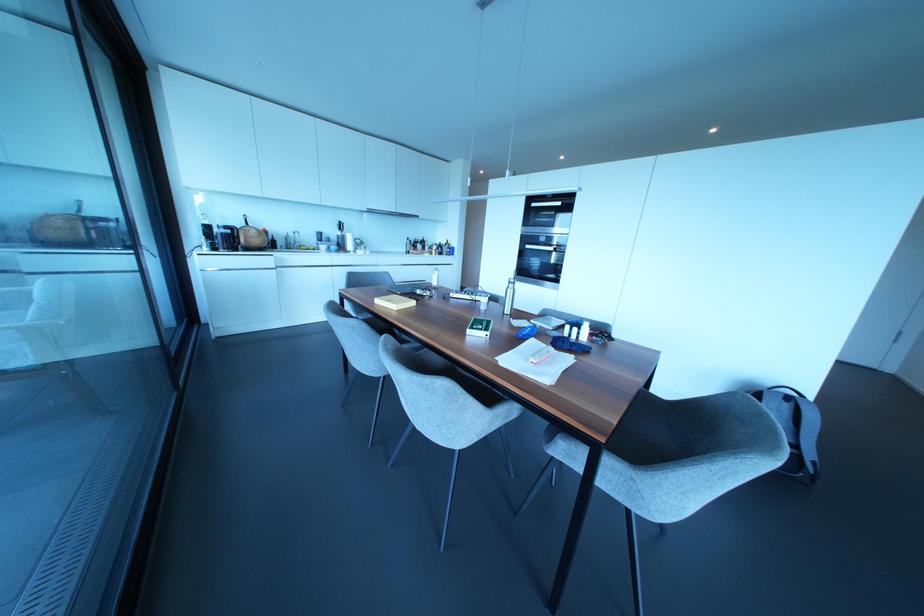
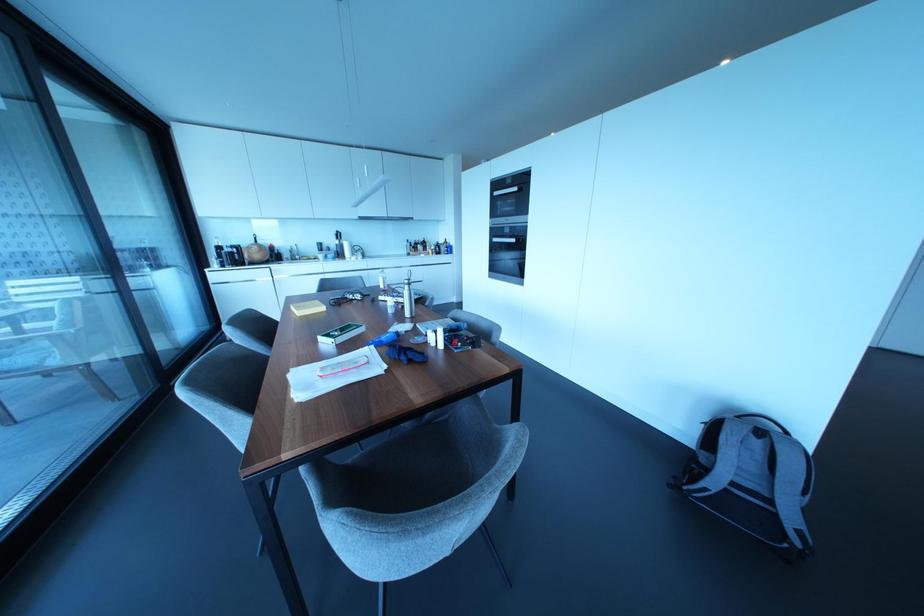
Find the pixel in the second image that matches [558,203] in the first image.

(515, 188)